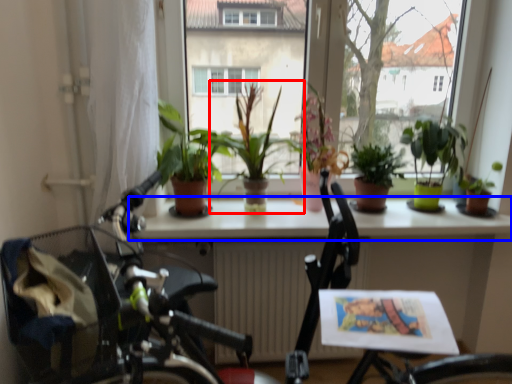
Question: Which of the following is the closest to the observer, houseplant (highlighted by a red box) or window sill (highlighted by a blue box)?

Choices:
 (A) houseplant
 (B) window sill

Answer: (A)